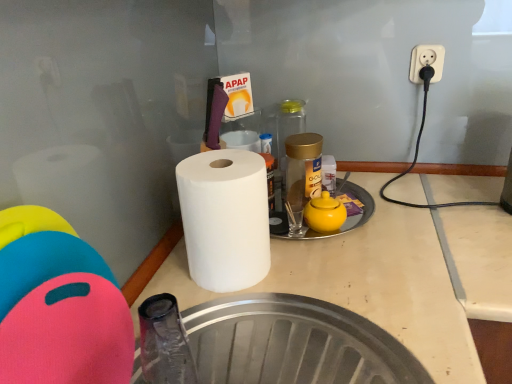
Question: Is white matte paper towel at center beside yellow matte teapot at center?

Choices:
 (A) yes
 (B) no

Answer: (B)

Question: Is white matte paper towel at center to the left of yellow matte teapot at center from the viewer's perspective?

Choices:
 (A) no
 (B) yes

Answer: (B)

Question: Can you confirm if white matte paper towel at center is shorter than yellow matte teapot at center?

Choices:
 (A) yes
 (B) no

Answer: (B)

Question: Considering the relative positions of white matte paper towel at center and yellow matte teapot at center in the image provided, is white matte paper towel at center in front of yellow matte teapot at center?

Choices:
 (A) no
 (B) yes

Answer: (B)

Question: Are white matte paper towel at center and yellow matte teapot at center far apart?

Choices:
 (A) no
 (B) yes

Answer: (A)

Question: Which is correct: rubberized plastic cutting board at left is inside transparent glass bottle at center, marked as the 2th bottle in a front-to-back arrangement, or outside of it?

Choices:
 (A) outside
 (B) inside

Answer: (A)

Question: From a real-world perspective, is rubberized plastic cutting board at left physically located above or below transparent glass bottle at center, marked as the 2th bottle in a front-to-back arrangement?

Choices:
 (A) above
 (B) below

Answer: (A)

Question: From the image's perspective, relative to transparent glass bottle at center, the 1th bottle from the back, is rubberized plastic cutting board at left above or below?

Choices:
 (A) below
 (B) above

Answer: (A)

Question: From their relative heights in the image, would you say rubberized plastic cutting board at left is taller or shorter than transparent glass bottle at center, the 1th bottle from the back?

Choices:
 (A) tall
 (B) short

Answer: (A)

Question: Based on their positions, is rubberized plastic cutting board at left located to the left or right of gold metallic jar at center, the 1th bottle positioned from the front?

Choices:
 (A) right
 (B) left

Answer: (B)

Question: Considering their positions, is rubberized plastic cutting board at left located in front of or behind gold metallic jar at center, the 1th bottle positioned from the front?

Choices:
 (A) behind
 (B) front

Answer: (B)

Question: From the image's perspective, is rubberized plastic cutting board at left located above or below gold metallic jar at center, the 1th bottle positioned from the front?

Choices:
 (A) above
 (B) below

Answer: (B)

Question: Is rubberized plastic cutting board at left taller or shorter than gold metallic jar at center, which appears as the second bottle when viewed from the back?

Choices:
 (A) short
 (B) tall

Answer: (B)

Question: Considering the positions of point pyautogui.click(x=303, y=167) and point pyautogui.click(x=116, y=372), is point pyautogui.click(x=303, y=167) closer or farther from the camera than point pyautogui.click(x=116, y=372)?

Choices:
 (A) closer
 (B) farther

Answer: (B)

Question: Looking at the image, does gold metallic jar at center, which appears as the second bottle when viewed from the back, seem bigger or smaller compared to rubberized plastic cutting board at left?

Choices:
 (A) big
 (B) small

Answer: (B)